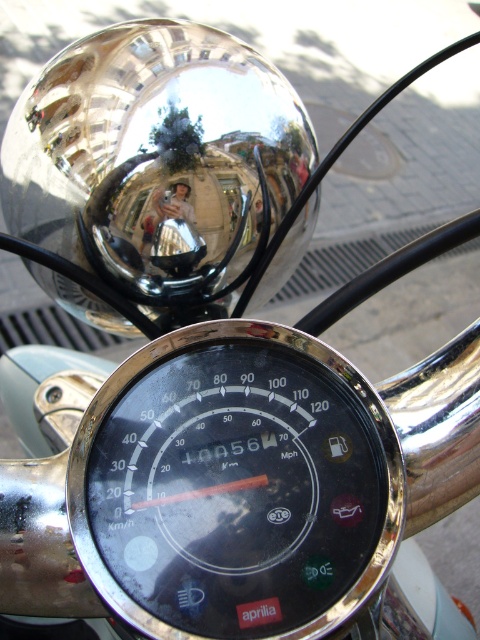
Does point (387, 493) lie in front of point (195, 218)?

That is True.

Locate an element on the screen. This screenshot has width=480, height=640. black glass speedometer at center is located at coordinates (235, 484).

Image resolution: width=480 pixels, height=640 pixels. Describe the element at coordinates (235, 484) in the screenshot. I see `black glass speedometer at center` at that location.

The height and width of the screenshot is (640, 480). What are the coordinates of `black glass speedometer at center` in the screenshot? It's located at (235, 484).